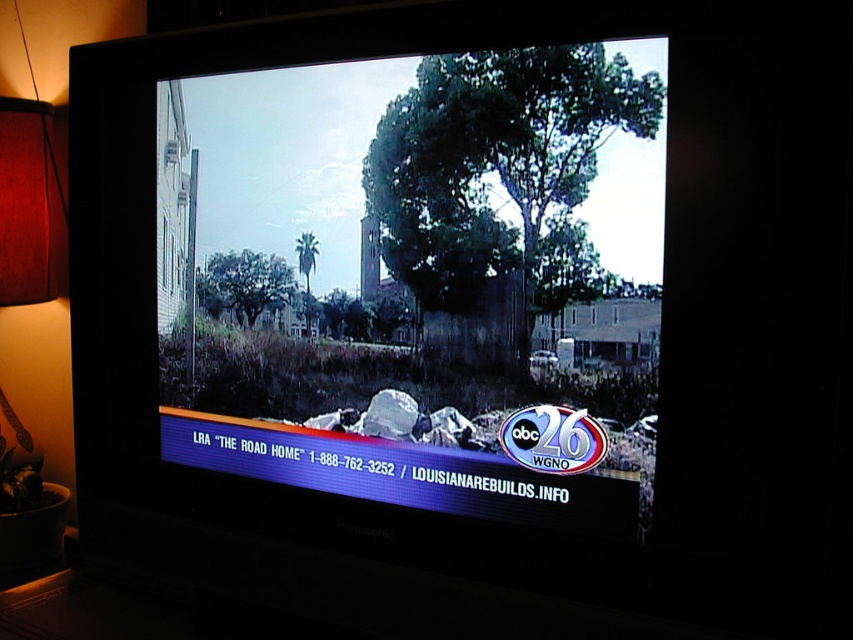
Does matte black television at center have a greater height compared to wooden lampshade at left?

Incorrect, matte black television at center's height is not larger of wooden lampshade at left's.

Consider the image. Is matte black television at center shorter than wooden lampshade at left?

Yes, matte black television at center is shorter than wooden lampshade at left.

Who is more distant from viewer, (648,308) or (22,452)?

The point (22,452) is behind.

Find the location of `matte black television at center`. matte black television at center is located at coordinates (421, 278).